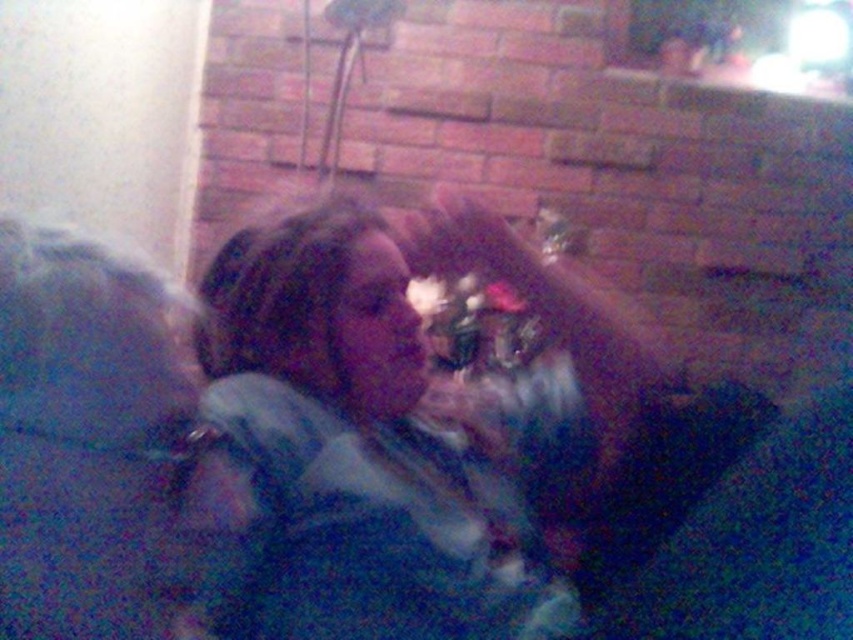
Question: Among these objects, which one is nearest to the camera?

Choices:
 (A) dark blue fabric at left
 (B) matte blue shirt at center

Answer: (A)

Question: Which point is closer to the camera taking this photo?

Choices:
 (A) (363, 413)
 (B) (148, 296)

Answer: (B)

Question: Can you confirm if matte blue shirt at center is smaller than dark blue fabric at left?

Choices:
 (A) no
 (B) yes

Answer: (A)

Question: Is matte blue shirt at center wider than dark blue fabric at left?

Choices:
 (A) no
 (B) yes

Answer: (B)

Question: Does matte blue shirt at center appear on the right side of dark blue fabric at left?

Choices:
 (A) yes
 (B) no

Answer: (A)

Question: Which point is closer to the camera?

Choices:
 (A) matte blue shirt at center
 (B) dark blue fabric at left

Answer: (B)